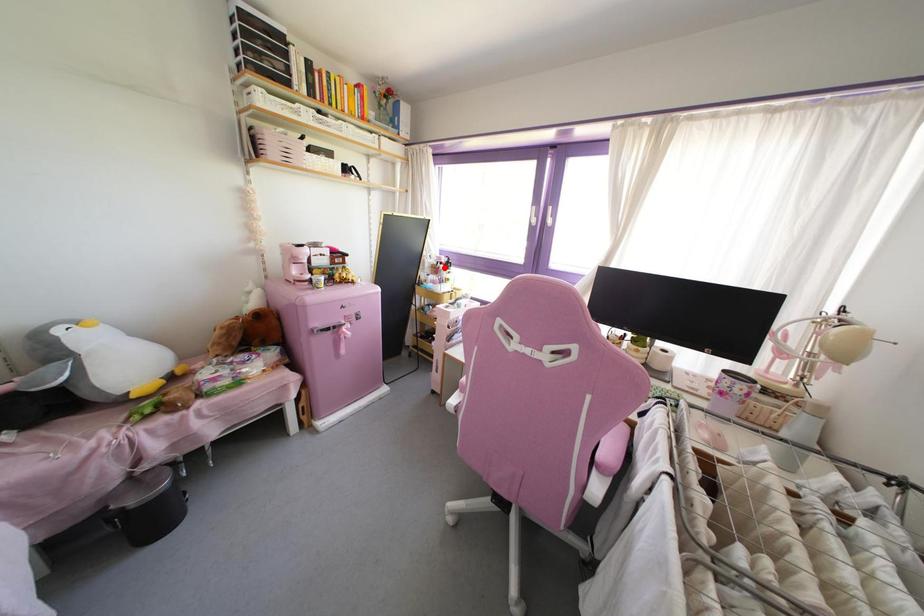
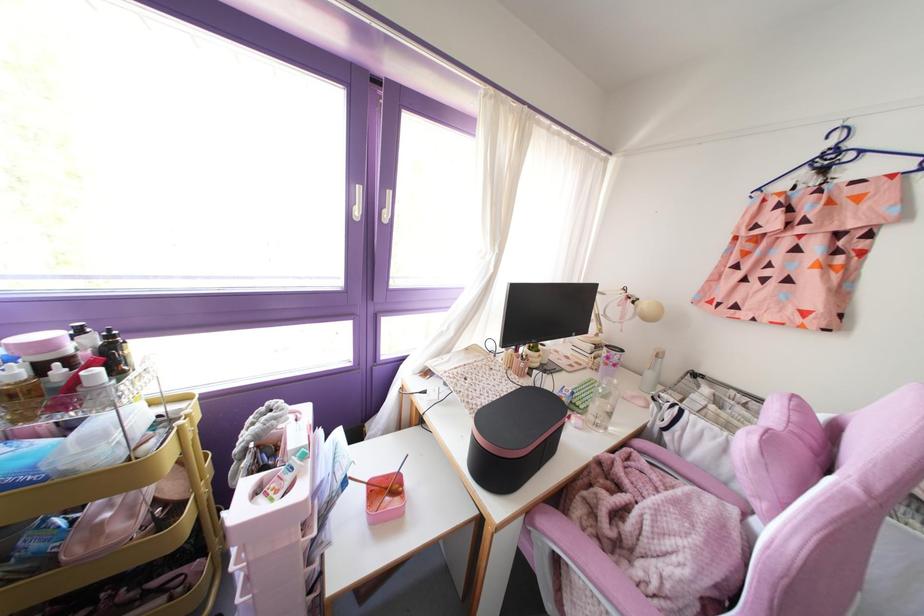
Where in the second image is the point corresponding to the highlighted location from the first image?

(116, 373)